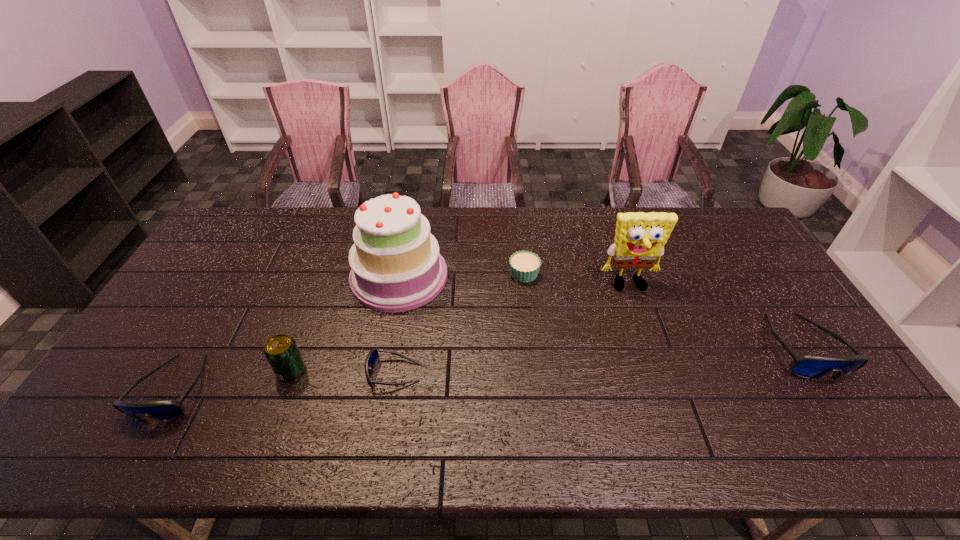
I want to click on free space between the second object from right to left and the third shortest object, so pos(401,337).

At what (x,y) coordinates should I click in order to perform the action: click on free space that is in between the third object from right to left and the second sunglasses from left to right. Please return your answer as a coordinate pair (x, y). The image size is (960, 540). Looking at the image, I should click on pos(459,323).

This screenshot has width=960, height=540. Find the location of `vacant point located between the rightmost sunglasses and the second sunglasses from right to left`. vacant point located between the rightmost sunglasses and the second sunglasses from right to left is located at coordinates (598, 360).

Find the location of `vacant point located between the cake and the second sunglasses from right to left`. vacant point located between the cake and the second sunglasses from right to left is located at coordinates (396, 325).

I want to click on free spot between the shortest sunglasses and the rightmost object, so click(x=598, y=360).

Select which object is the second closest to the cake. Please provide its 2D coordinates. Your answer should be formatted as a tuple, i.e. [(x, y)], where the tuple contains the x and y coordinates of a point satisfying the conditions above.

[(281, 351)]

This screenshot has height=540, width=960. What are the coordinates of `object identified as the fifth closest to the second shortest sunglasses` in the screenshot? It's located at (640, 237).

Locate which sunglasses ranks second in proximity to the cupcake. Please provide its 2D coordinates. Your answer should be formatted as a tuple, i.e. [(x, y)], where the tuple contains the x and y coordinates of a point satisfying the conditions above.

[(808, 366)]

Locate an element on the screen. sunglasses that is the second closest to the third tallest object is located at coordinates (164, 410).

Where is `blank area in the image that satisfies the following two spatial constraints: 1. on the back side of the cake; 2. on the right side of the second object from left to right`? The image size is (960, 540). blank area in the image that satisfies the following two spatial constraints: 1. on the back side of the cake; 2. on the right side of the second object from left to right is located at coordinates (325, 276).